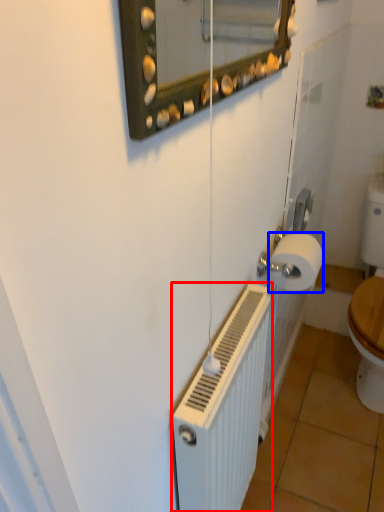
Question: Which object appears farthest to the camera in this image, radiator (highlighted by a red box) or toilet paper (highlighted by a blue box)?

Choices:
 (A) radiator
 (B) toilet paper

Answer: (B)